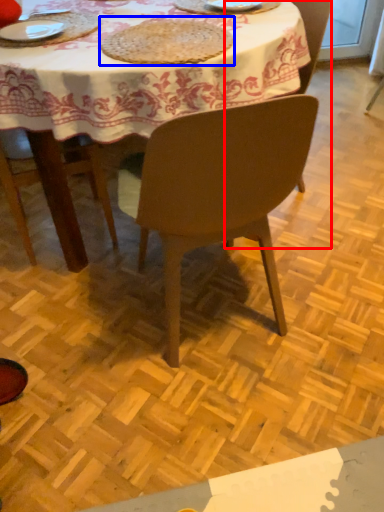
Question: Which point is further to the camera, chair (highlighted by a red box) or mat (highlighted by a blue box)?

Choices:
 (A) chair
 (B) mat

Answer: (A)